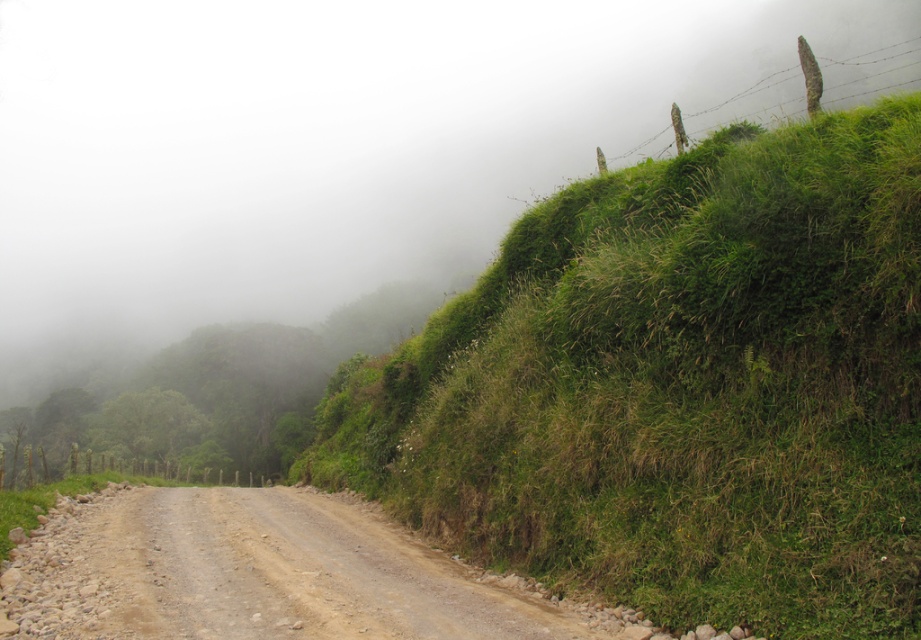
Is green grassy hillside at upper right shorter than dusty gravel road at center?

No, green grassy hillside at upper right is not shorter than dusty gravel road at center.

Between green grassy hillside at upper right and dusty gravel road at center, which one appears on the left side from the viewer's perspective?

A: dusty gravel road at center is more to the left.

Which is in front, point (552, 324) or point (8, 602)?

Positioned in front is point (8, 602).

Where is `green grassy hillside at upper right`? The image size is (921, 640). green grassy hillside at upper right is located at coordinates (679, 387).